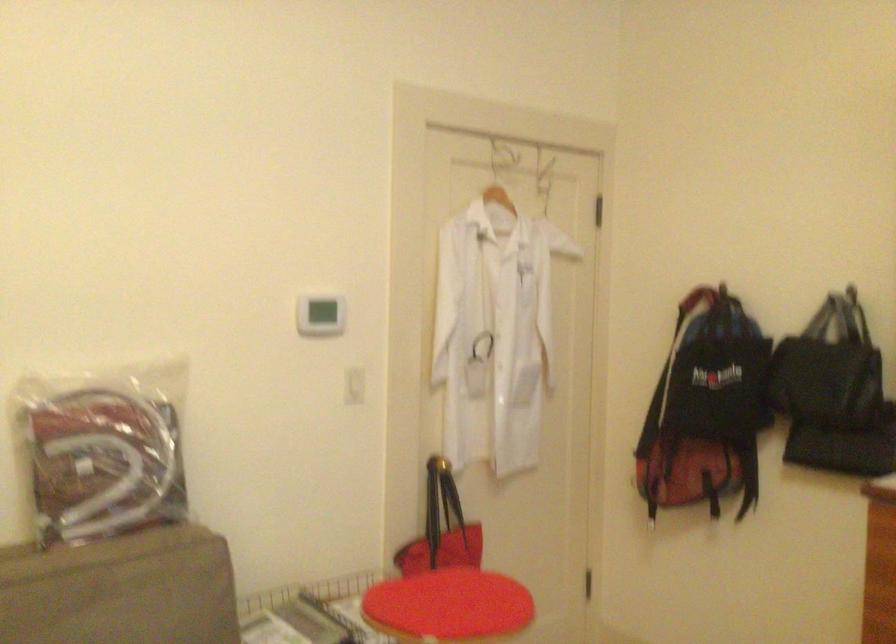
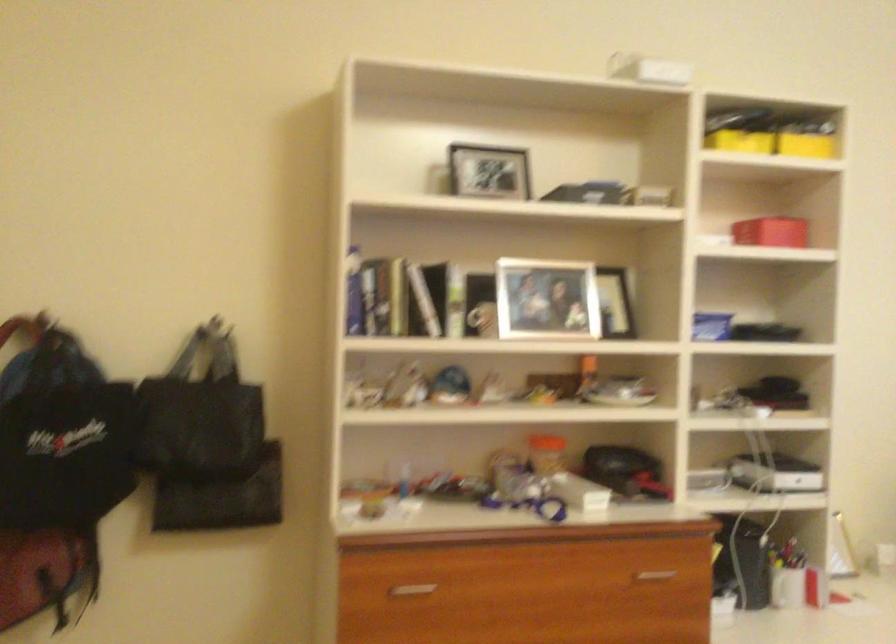
Question: Based on the continuous images, in which direction is the camera rotating? Reply with the corresponding letter.

Choices:
 (A) Left
 (B) Right
 (C) Up
 (D) Down

Answer: (B)